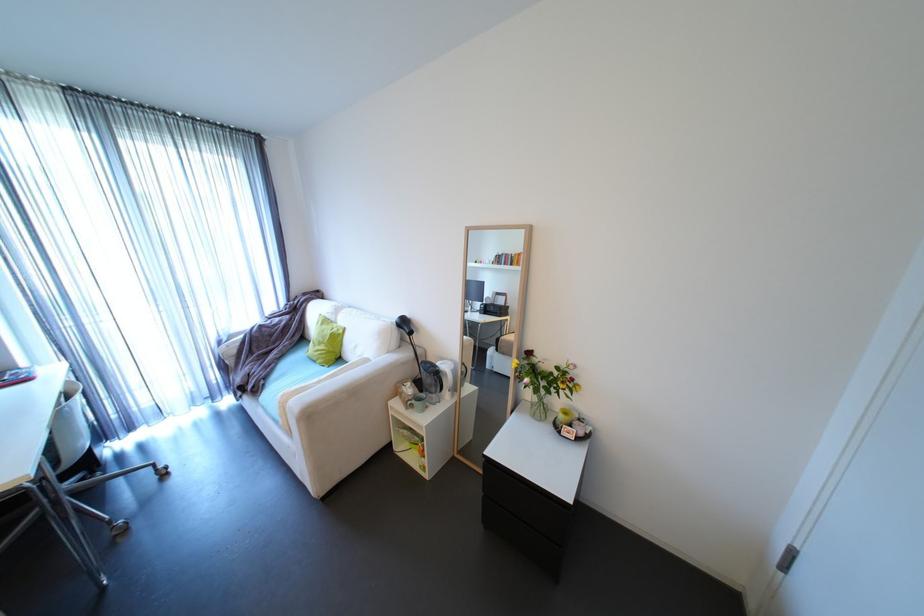
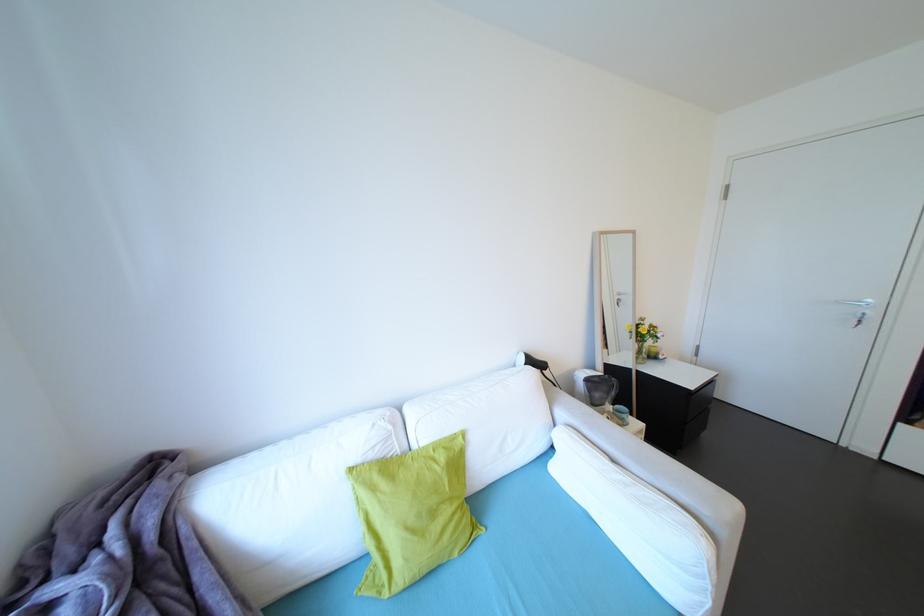
Locate, in the second image, the point that corresponds to [345,329] in the first image.

(451, 448)